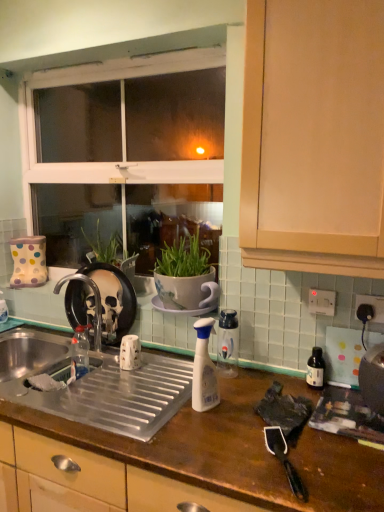
The width and height of the screenshot is (384, 512). Find the location of `white plastic electric outlet at upper right, the first electric outlet from the left`. white plastic electric outlet at upper right, the first electric outlet from the left is located at coordinates (322, 302).

The image size is (384, 512). What are the coordinates of `black matte faucet at sink left` in the screenshot? It's located at (95, 302).

Describe the element at coordinates (132, 158) in the screenshot. I see `white plastic window screen at upper center` at that location.

Image resolution: width=384 pixels, height=512 pixels. Describe the element at coordinates (80, 354) in the screenshot. I see `translucent plastic bottle at sink, positioned as the 4th bottle in front-to-back order` at that location.

In order to click on white plastic electric outlet at upper right, marked as the first electric outlet in a back-to-front arrangement in this screenshot , I will do `click(322, 302)`.

Between black matte faucet at sink left and black glass bottle at right, marked as the 2th bottle in a front-to-back arrangement, which one has larger size?

black matte faucet at sink left.

Considering the relative sizes of black matte faucet at sink left and black glass bottle at right, marked as the 2th bottle in a front-to-back arrangement, in the image provided, is black matte faucet at sink left shorter than black glass bottle at right, marked as the 2th bottle in a front-to-back arrangement,?

Incorrect, the height of black matte faucet at sink left does not fall short of that of black glass bottle at right, marked as the 2th bottle in a front-to-back arrangement.

Is black matte faucet at sink left wider or thinner than black glass bottle at right, the 4th bottle from the left?

black matte faucet at sink left is wider than black glass bottle at right, the 4th bottle from the left.

From their relative heights in the image, would you say metallic stainless steel kettle at right, which appears as the 2th appliance when viewed from the back, is taller or shorter than brown wooden countertop at center?

Considering their sizes, metallic stainless steel kettle at right, which appears as the 2th appliance when viewed from the back, has less height than brown wooden countertop at center.

Looking at the image, does metallic stainless steel kettle at right, the second appliance positioned from the left, seem bigger or smaller compared to brown wooden countertop at center?

metallic stainless steel kettle at right, the second appliance positioned from the left, is smaller than brown wooden countertop at center.

Based on the photo, can you confirm if metallic stainless steel kettle at right, the 1th appliance viewed from the front, is wider than brown wooden countertop at center?

Result: Incorrect, the width of metallic stainless steel kettle at right, the 1th appliance viewed from the front, does not surpass that of brown wooden countertop at center.

At what (x,y) coordinates should I click in order to perform the action: click on appliance that is the 1st one above the brown wooden countertop at center (from a real-world perspective). Please return your answer as a coordinate pair (x, y). Looking at the image, I should click on (373, 378).

What's the angular difference between metallic stainless steel kettle at right, the second appliance positioned from the left, and white plastic spray bottle at center, placed as the first bottle when sorted from front to back,'s facing directions?

0.00343 degrees.

Where is `bottle that is the 1st one when counting backward from the metallic stainless steel kettle at right, the second appliance positioned from the left`? Image resolution: width=384 pixels, height=512 pixels. bottle that is the 1st one when counting backward from the metallic stainless steel kettle at right, the second appliance positioned from the left is located at coordinates pyautogui.click(x=204, y=369).

From a real-world perspective, who is located lower, metallic stainless steel kettle at right, which appears as the 2th appliance when viewed from the back, or white plastic spray bottle at center, which is the 4th bottle in back-to-front order?

From a 3D spatial view, metallic stainless steel kettle at right, which appears as the 2th appliance when viewed from the back, is below.

Which is less distant, (369, 352) or (205, 330)?

Point (369, 352) is farther from the camera than point (205, 330).

Is metallic stainless steel kettle at right, the second appliance positioned from the left, smaller than white plastic window screen at upper center?

Yes, metallic stainless steel kettle at right, the second appliance positioned from the left, is smaller than white plastic window screen at upper center.

Is metallic stainless steel kettle at right, the first appliance from the right, outside of white plastic window screen at upper center?

That's correct, metallic stainless steel kettle at right, the first appliance from the right, is outside of white plastic window screen at upper center.

Considering the positions of objects metallic stainless steel kettle at right, which appears as the first appliance when ordered from the bottom, and white plastic window screen at upper center in the image provided, who is behind, metallic stainless steel kettle at right, which appears as the first appliance when ordered from the bottom, or white plastic window screen at upper center?

white plastic window screen at upper center is more distant.

Which object is closer to the camera taking this photo, white plastic spray bottle at center, acting as the third bottle starting from the right, or black glass bottle at right, marked as the 2th bottle in a front-to-back arrangement?

Positioned in front is white plastic spray bottle at center, acting as the third bottle starting from the right.

Who is bigger, white plastic spray bottle at center, acting as the third bottle starting from the right, or black glass bottle at right, which is the third bottle in back-to-front order?

Bigger between the two is white plastic spray bottle at center, acting as the third bottle starting from the right.

Considering the relative sizes of white plastic spray bottle at center, placed as the first bottle when sorted from front to back, and black glass bottle at right, which is the third bottle in back-to-front order, in the image provided, is white plastic spray bottle at center, placed as the first bottle when sorted from front to back, shorter than black glass bottle at right, which is the third bottle in back-to-front order,?

No.

Between white plastic spray bottle at center, placed as the first bottle when sorted from front to back, and black glass bottle at right, which is the third bottle in back-to-front order, which one appears on the right side from the viewer's perspective?

black glass bottle at right, which is the third bottle in back-to-front order, is more to the right.

Is white plastic electric outlet at upper right, the second electric outlet positioned from the front, shorter than matte wood cabinet at upper right?

Yes.

This screenshot has width=384, height=512. Find the location of `cabinetry on the left side of white plastic electric outlet at upper right, the second electric outlet positioned from the front`. cabinetry on the left side of white plastic electric outlet at upper right, the second electric outlet positioned from the front is located at coordinates (313, 137).

From a real-world perspective, which is physically below, white plastic electric outlet at upper right, arranged as the 2th electric outlet when viewed from the right, or matte wood cabinet at upper right?

From a 3D spatial view, white plastic electric outlet at upper right, arranged as the 2th electric outlet when viewed from the right, is below.

Consider the image. Considering the positions of objects white plastic electric outlet at upper right, marked as the first electric outlet in a back-to-front arrangement, and matte wood cabinet at upper right in the image provided, who is behind, white plastic electric outlet at upper right, marked as the first electric outlet in a back-to-front arrangement, or matte wood cabinet at upper right?

white plastic electric outlet at upper right, marked as the first electric outlet in a back-to-front arrangement.

Could white plastic spray bottle at center, acting as the third bottle starting from the right, be considered to be inside transparent plastic spray bottle at center, which is the 3th bottle from left to right?

No, white plastic spray bottle at center, acting as the third bottle starting from the right, is not inside transparent plastic spray bottle at center, which is the 3th bottle from left to right.

I want to click on bottle that is the 2nd one when counting backward from the white plastic spray bottle at center, acting as the third bottle starting from the right, so click(228, 343).

Does transparent plastic spray bottle at center, the second bottle positioned from the right, have a larger size compared to white plastic spray bottle at center, which is the 4th bottle in back-to-front order?

Incorrect, transparent plastic spray bottle at center, the second bottle positioned from the right, is not larger than white plastic spray bottle at center, which is the 4th bottle in back-to-front order.

Is transparent plastic spray bottle at center, the third bottle in the front-to-back sequence, directly adjacent to white plastic spray bottle at center, acting as the third bottle starting from the right?

There is a gap between transparent plastic spray bottle at center, the third bottle in the front-to-back sequence, and white plastic spray bottle at center, acting as the third bottle starting from the right.

You are a GUI agent. You are given a task and a screenshot of the screen. Output one action in this format:
    pyautogui.click(x=<x>, y=<y>)
    Task: Click on the tap behind the black glass bottle at right, the 4th bottle from the left
    This screenshot has width=384, height=512.
    Given the screenshot: What is the action you would take?
    pyautogui.click(x=95, y=302)

This screenshot has height=512, width=384. Find the location of `countertop directly beneath the metallic stainless steel kettle at right, placed as the second appliance when sorted from top to bottom (from a real-world perspective)`. countertop directly beneath the metallic stainless steel kettle at right, placed as the second appliance when sorted from top to bottom (from a real-world perspective) is located at coordinates (235, 450).

When comparing their distances from polka dot ceramic boot at left, acting as the 2th appliance starting from the front, does brown wooden countertop at center or white plastic spray bottle at center, which is the 4th bottle in back-to-front order, seem closer?

Among the two, brown wooden countertop at center is located nearer to polka dot ceramic boot at left, acting as the 2th appliance starting from the front.

Which object lies nearer to the anchor point brown wooden countertop at center, white plastic window screen at upper center or matte wood cabinet at upper right?

matte wood cabinet at upper right lies closer to brown wooden countertop at center than the other object.

Looking at the image, which one is located closer to polka dot ceramic boot at left, the 2th appliance in the right-to-left sequence, black matte faucet at sink left or transparent plastic spray bottle at center, which is the 3th bottle from left to right?

Based on the image, black matte faucet at sink left appears to be nearer to polka dot ceramic boot at left, the 2th appliance in the right-to-left sequence.

Based on their spatial positions, is black matte faucet at sink left or matte wood cabinet at upper right further from white plastic window screen at upper center?

matte wood cabinet at upper right is positioned further to the anchor white plastic window screen at upper center.

From the picture: Estimate the real-world distances between objects in this image. Which object is closer to white plastic electric outlet at upper right, arranged as the 2th electric outlet when viewed from the right, translucent plastic bottle at sink, the 4th bottle in the right-to-left sequence, or matte wood cabinet at upper right?

matte wood cabinet at upper right is positioned closer to the anchor white plastic electric outlet at upper right, arranged as the 2th electric outlet when viewed from the right.

Looking at the image, which one is located closer to transparent plastic spray bottle at center, which is counted as the 2th bottle, starting from the back, white plastic window screen at upper center or white plastic spray bottle at center, acting as the third bottle starting from the right?

Based on the image, white plastic spray bottle at center, acting as the third bottle starting from the right, appears to be nearer to transparent plastic spray bottle at center, which is counted as the 2th bottle, starting from the back.

Considering their positions, is translucent plastic bottle at sink, the 1th bottle positioned from the back, positioned further to matte wood cabinet at upper right than brown wooden countertop at center?

translucent plastic bottle at sink, the 1th bottle positioned from the back, is further to matte wood cabinet at upper right.

From the picture: Based on their spatial positions, is white plastic window screen at upper center or brown wooden countertop at center closer to white plastic electric outlet at upper right, the first electric outlet from the left?

brown wooden countertop at center.

You are a GUI agent. You are given a task and a screenshot of the screen. Output one action in this format:
    pyautogui.click(x=<x>, y=<y>)
    Task: Click on the tap situated between polka dot ceramic boot at left, placed as the 2th appliance when sorted from bottom to top, and white plastic electric outlet at upper right, arranged as the 2th electric outlet when viewed from the right, from left to right
    The width and height of the screenshot is (384, 512).
    Given the screenshot: What is the action you would take?
    pyautogui.click(x=95, y=302)

Find the location of a particular element. This screenshot has height=512, width=384. bottle that lies between matte wood cabinet at upper right and white plastic spray bottle at center, which is the 4th bottle in back-to-front order, from top to bottom is located at coordinates (228, 343).

Where is `cabinetry located between black matte faucet at sink left and black glass bottle at right, marked as the 2th bottle in a front-to-back arrangement, in the left-right direction`? cabinetry located between black matte faucet at sink left and black glass bottle at right, marked as the 2th bottle in a front-to-back arrangement, in the left-right direction is located at coordinates (313, 137).

Locate an element on the screen. The height and width of the screenshot is (512, 384). bottle between translucent plastic bottle at sink, positioned as the 4th bottle in front-to-back order, and transparent plastic spray bottle at center, the third bottle in the front-to-back sequence is located at coordinates (204, 369).